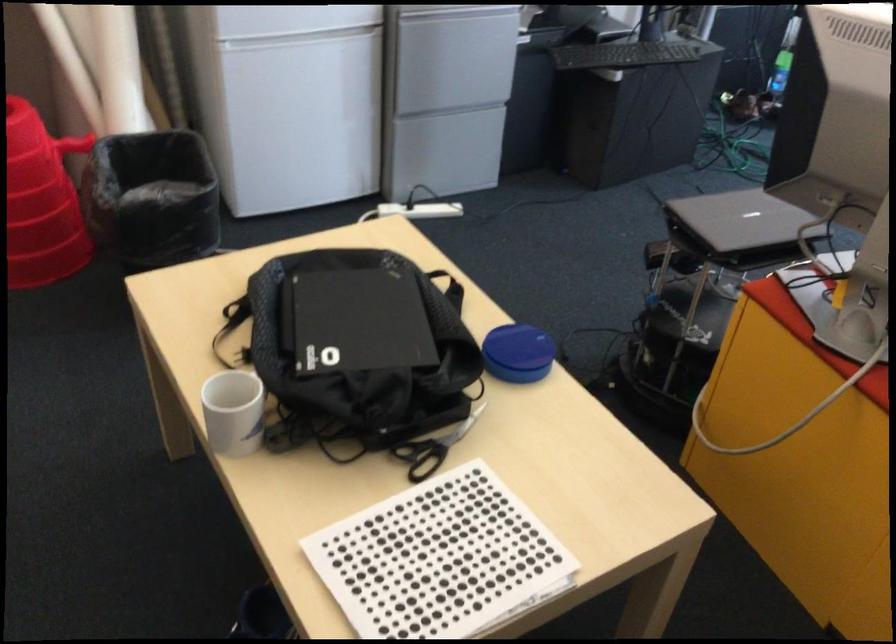
Where is `white power strip`? The height and width of the screenshot is (644, 896). white power strip is located at coordinates (419, 210).